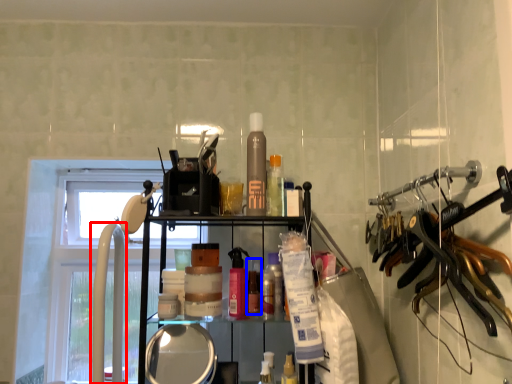
Question: Which object is closer to the camera taking this photo, faucet (highlighted by a red box) or toiletry (highlighted by a blue box)?

Choices:
 (A) faucet
 (B) toiletry

Answer: (A)